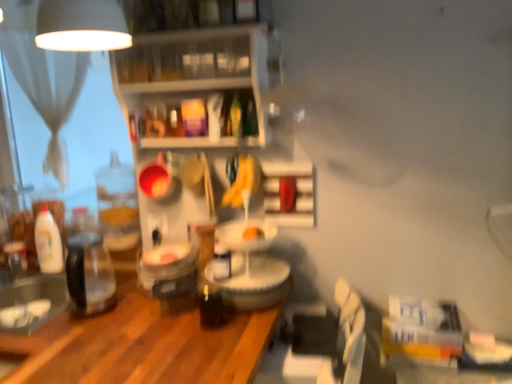
Image resolution: width=512 pixels, height=384 pixels. Identify the location of free space in front of clear glass jar at left. [62, 341].